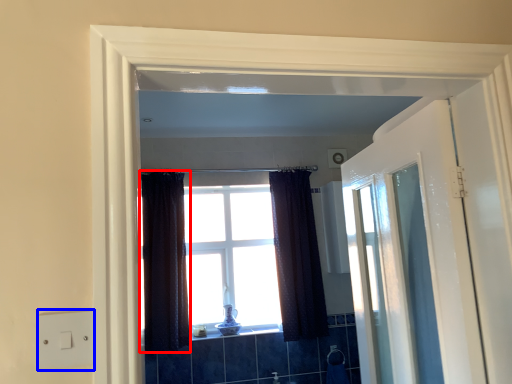
Question: Among these objects, which one is nearest to the camera, curtain (highlighted by a red box) or electric outlet (highlighted by a blue box)?

Choices:
 (A) curtain
 (B) electric outlet

Answer: (B)